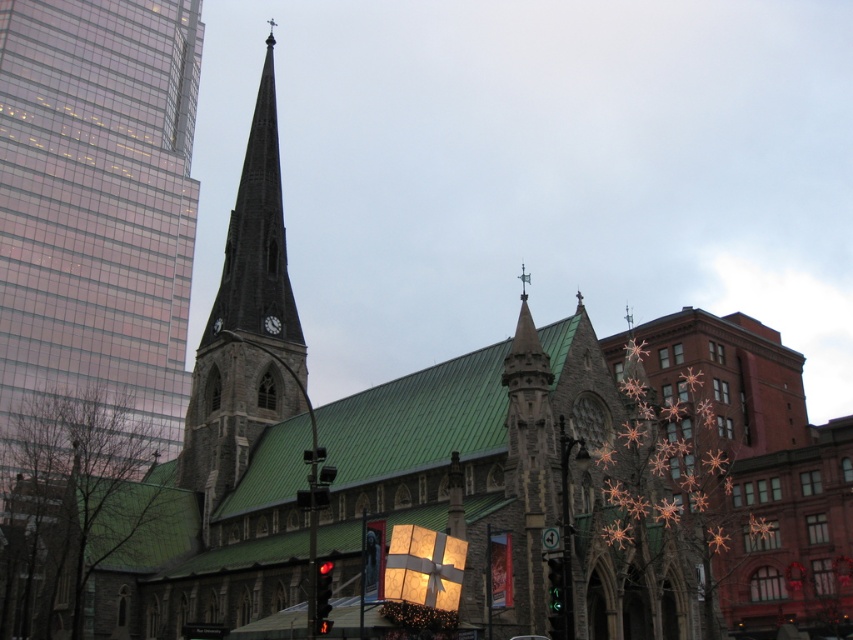
You are a delivery drone with a wingspan of 1.5 meters. You need to fly between the red glass traffic light at lower center and the green glass traffic light at center to deliver a package. Can you safely navigate through the space between them?

The distance between the red glass traffic light at lower center and the green glass traffic light at center is 10.15 meters. Since your wingspan is 1.5 meters, which is much smaller than the available space, you can safely navigate through the space between them.